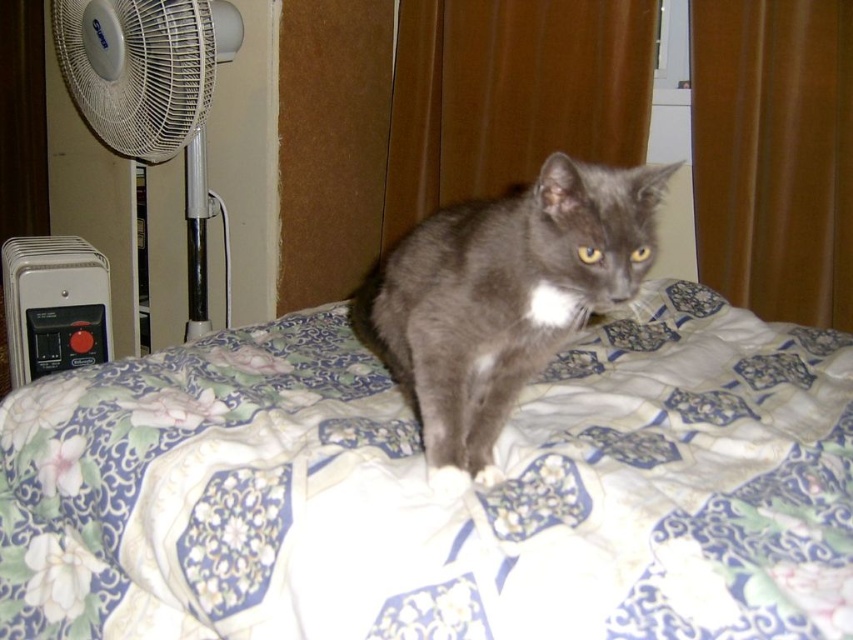
You are a pet owner who wants to ensure your cat stays warm. The gray matte fur cat at center is currently sitting on a bed with a floral quilt. You have a white plastic radiator at lower left. Can you move the cat to a warmer spot near the radiator?

The gray matte fur cat at center is positioned under the white plastic radiator at lower left, so moving it closer to the radiator would not necessarily make it warmer since it is already under the radiator.

You are a pet sitter checking the room for the gray matte fur cat at center. You notice the white plastic radiator at lower left. Which object is taller?

The gray matte fur cat at center is not as tall as the white plastic radiator at lower left, so the white plastic radiator at lower left is taller.

You are taking a photo of the gray cat on the bed. You notice two points in the image at coordinates point (x=534, y=518) and point (x=646, y=216). Which point will appear larger in the photo?

Point (x=534, y=518) is closer to the camera than point (x=646, y=216), so it will appear larger in the photo.